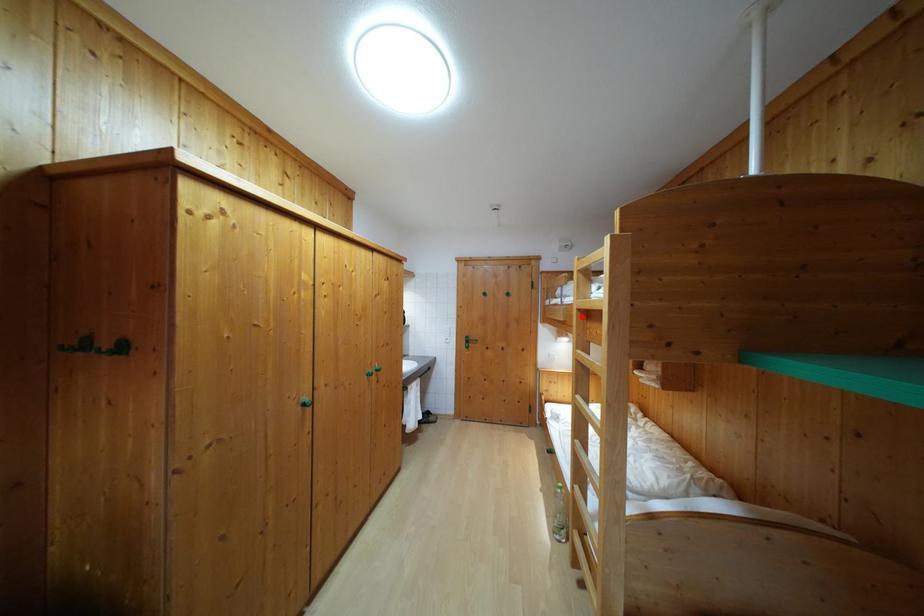
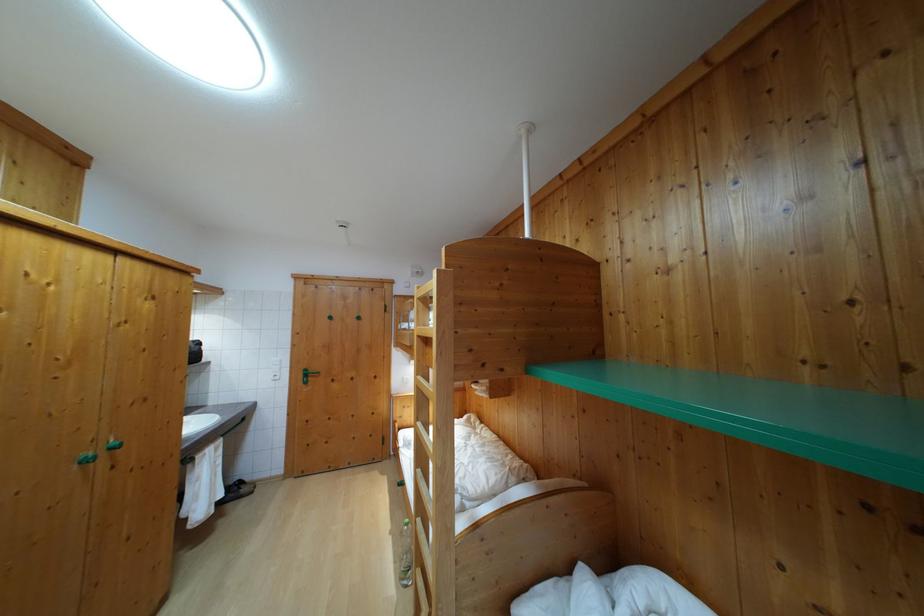
The point at the highlighted location is marked in the first image. Where is the corresponding point in the second image?

(421, 342)